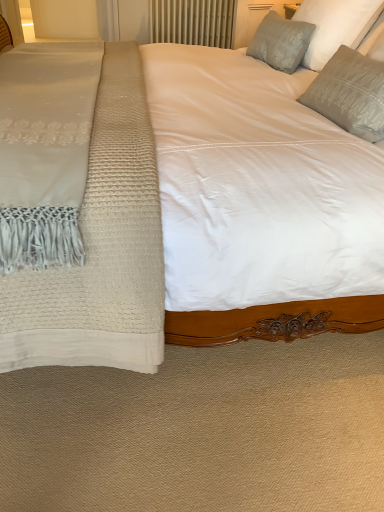
Question: Is gray textured pillow at upper right, the second pillow from the front, not inside transparent glass door at upper left?

Choices:
 (A) no
 (B) yes

Answer: (B)

Question: From the image's perspective, would you say gray textured pillow at upper right, positioned as the 2th pillow in back-to-front order, is positioned over transparent glass door at upper left?

Choices:
 (A) yes
 (B) no

Answer: (B)

Question: Is gray textured pillow at upper right, the second pillow from the front, facing towards transparent glass door at upper left?

Choices:
 (A) yes
 (B) no

Answer: (B)

Question: Considering the relative sizes of gray textured pillow at upper right, the second pillow from the front, and transparent glass door at upper left in the image provided, is gray textured pillow at upper right, the second pillow from the front, shorter than transparent glass door at upper left?

Choices:
 (A) no
 (B) yes

Answer: (B)

Question: Is the depth of gray textured pillow at upper right, the second pillow from the front, less than that of transparent glass door at upper left?

Choices:
 (A) yes
 (B) no

Answer: (A)

Question: Is gray textured pillow at upper right, positioned as the 2th pillow in back-to-front order, to the left of transparent glass door at upper left from the viewer's perspective?

Choices:
 (A) no
 (B) yes

Answer: (A)

Question: Would you say metallic radiator at upper center is a long distance from transparent glass door at upper left?

Choices:
 (A) no
 (B) yes

Answer: (B)

Question: From a real-world perspective, is metallic radiator at upper center positioned over transparent glass door at upper left based on gravity?

Choices:
 (A) no
 (B) yes

Answer: (B)

Question: Considering the relative sizes of metallic radiator at upper center and transparent glass door at upper left in the image provided, is metallic radiator at upper center shorter than transparent glass door at upper left?

Choices:
 (A) no
 (B) yes

Answer: (B)

Question: Is metallic radiator at upper center at the right side of transparent glass door at upper left?

Choices:
 (A) yes
 (B) no

Answer: (A)

Question: Considering the relative sizes of metallic radiator at upper center and transparent glass door at upper left in the image provided, is metallic radiator at upper center bigger than transparent glass door at upper left?

Choices:
 (A) yes
 (B) no

Answer: (B)

Question: Is metallic radiator at upper center thinner than transparent glass door at upper left?

Choices:
 (A) no
 (B) yes

Answer: (B)

Question: From the image's perspective, is satin gray pillow at upper right, the 1th pillow when ordered from back to front, above transparent glass door at upper left?

Choices:
 (A) no
 (B) yes

Answer: (A)